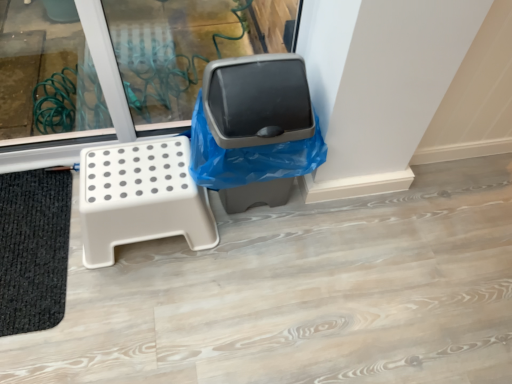
Question: From their relative heights in the image, would you say matte plastic trash can at center is taller or shorter than black textured bath mat at lower left?

Choices:
 (A) tall
 (B) short

Answer: (A)

Question: From the image's perspective, is matte plastic trash can at center located above or below black textured bath mat at lower left?

Choices:
 (A) below
 (B) above

Answer: (B)

Question: Estimate the real-world distances between objects in this image. Which object is farther from the black textured bath mat at lower left?

Choices:
 (A) white plastic stool at left
 (B) matte plastic trash can at center

Answer: (B)

Question: Based on their relative distances, which object is nearer to the matte plastic trash can at center?

Choices:
 (A) black textured bath mat at lower left
 (B) white plastic stool at left

Answer: (B)